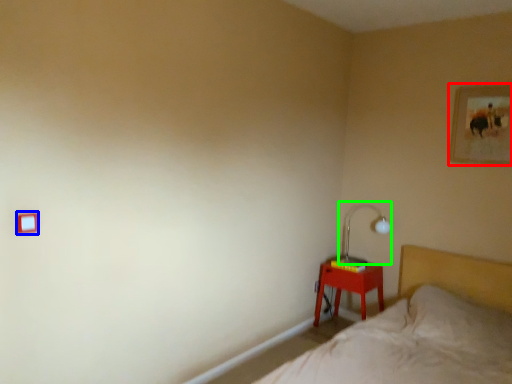
Question: Which object is positioned closest to picture frame (highlighted by a red box)? Select from light switch (highlighted by a blue box) and table lamp (highlighted by a green box).

Choices:
 (A) light switch
 (B) table lamp

Answer: (B)